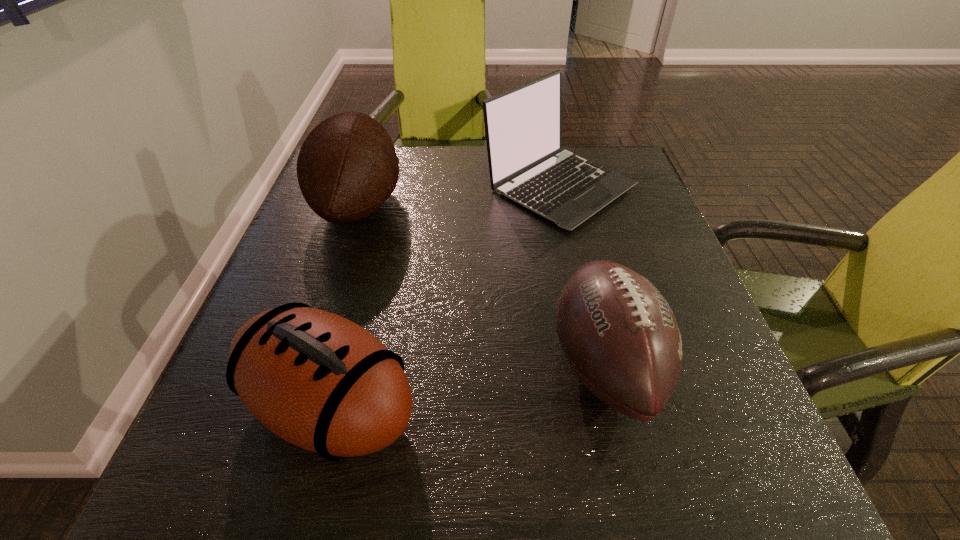
I want to click on object that is at the far left corner, so click(347, 167).

I want to click on object that is at the near left corner, so click(x=319, y=381).

Locate an element on the screen. object positioned at the far right corner is located at coordinates (523, 126).

You are a GUI agent. You are given a task and a screenshot of the screen. Output one action in this format:
    pyautogui.click(x=<x>, y=<y>)
    Task: Click on the object that is at the near right corner
    This screenshot has width=960, height=540.
    Given the screenshot: What is the action you would take?
    pyautogui.click(x=619, y=335)

In the image, there is a desktop. Where is `vacant space at the far edge`? The width and height of the screenshot is (960, 540). vacant space at the far edge is located at coordinates (457, 153).

The image size is (960, 540). In order to click on vacant area at the near edge in this screenshot , I will do (x=392, y=467).

Image resolution: width=960 pixels, height=540 pixels. In order to click on blank area at the left edge in this screenshot , I will do `click(285, 287)`.

In the image, there is a desktop. Where is `vacant space at the right edge`? This screenshot has height=540, width=960. vacant space at the right edge is located at coordinates (646, 209).

Locate an element on the screen. vacant area at the far right corner of the desktop is located at coordinates (638, 172).

Locate an element on the screen. This screenshot has height=540, width=960. vacant area between the farthest football (American) and the rightmost football (American) is located at coordinates (482, 285).